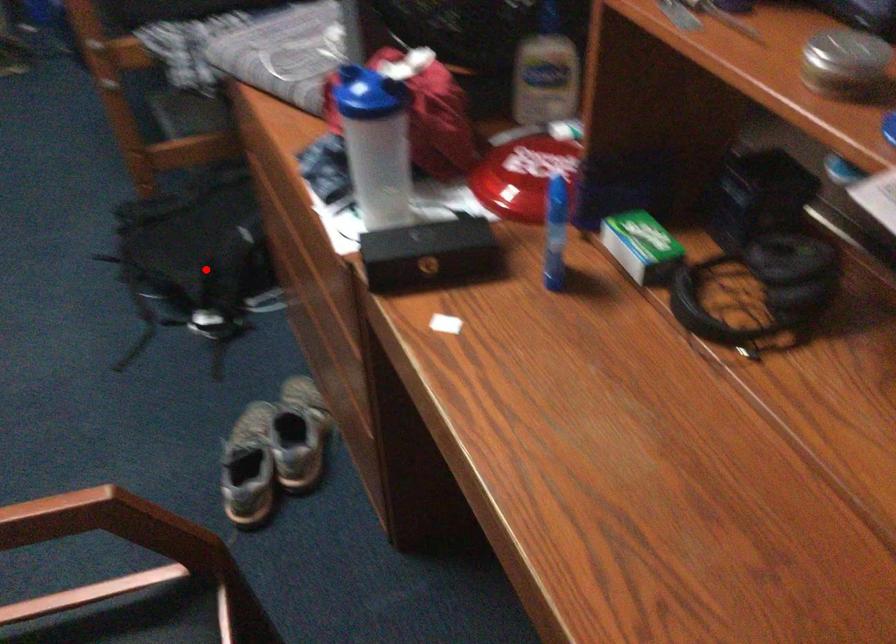
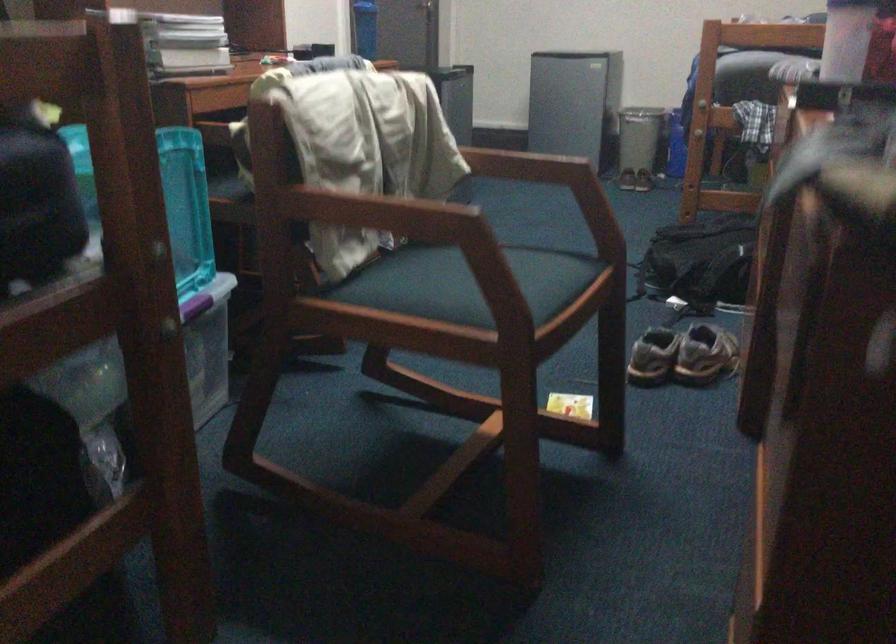
Find the pixel in the second image that matches the highlighted location in the first image.

(701, 260)